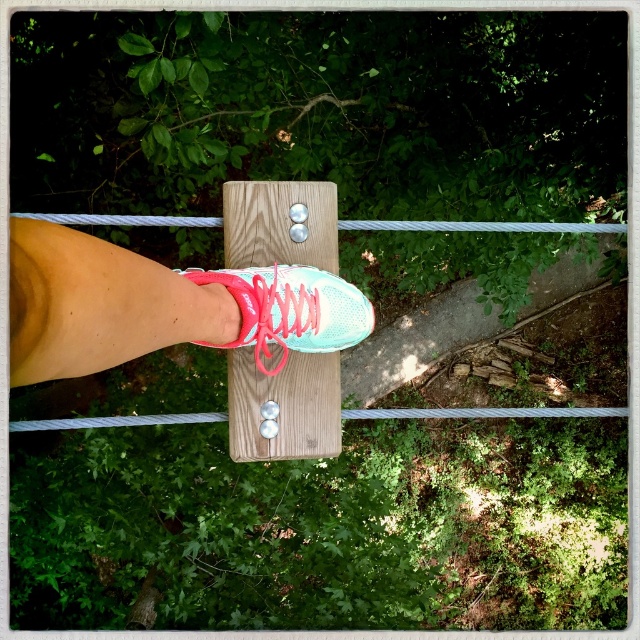
You are looking at the wooden plank from above. Two points are marked on it. Which point is closer to you, point (280, 362) or point (312, 340)?

Point (280, 362) is closer to you than point (312, 340) because it is further to the viewer according to the description.

You are a photographer trying to capture the shiny teal sneaker at center and the teal matte shoe at center in a single shot. Which one appears shorter in the photo?

The shiny teal sneaker at center appears shorter because it is not as tall as the teal matte shoe at center.

Based on the photo, you are a photographer trying to capture the shiny teal sneaker at center and the teal matte shoe at center in the same frame. Which one appears closer to the camera based on their positions?

The shiny teal sneaker at center is positioned over the teal matte shoe at center, so it appears closer to the camera.